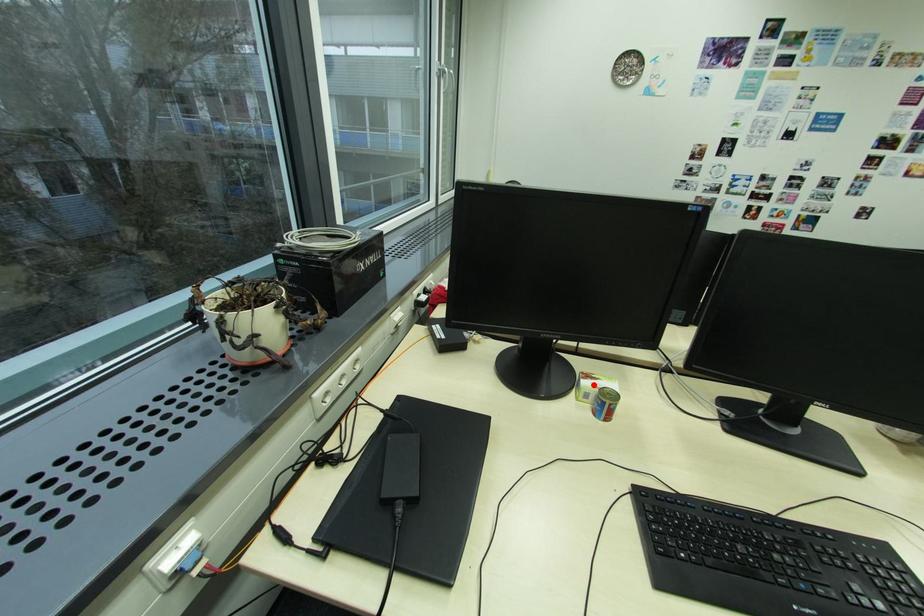
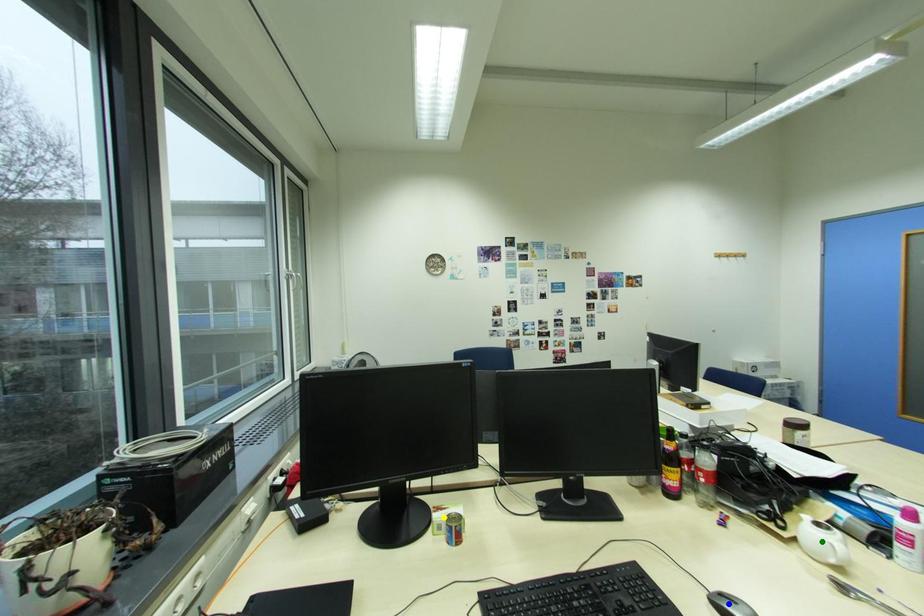
Question: I am providing you with two images of the same scene from different viewpoints. A red point is marked on the first image. You are given multiple points on the second image. Which point in image 2 represents the same 3d spot as the red point in image 1?

Choices:
 (A) green point
 (B) blue point
 (C) yellow point

Answer: (C)